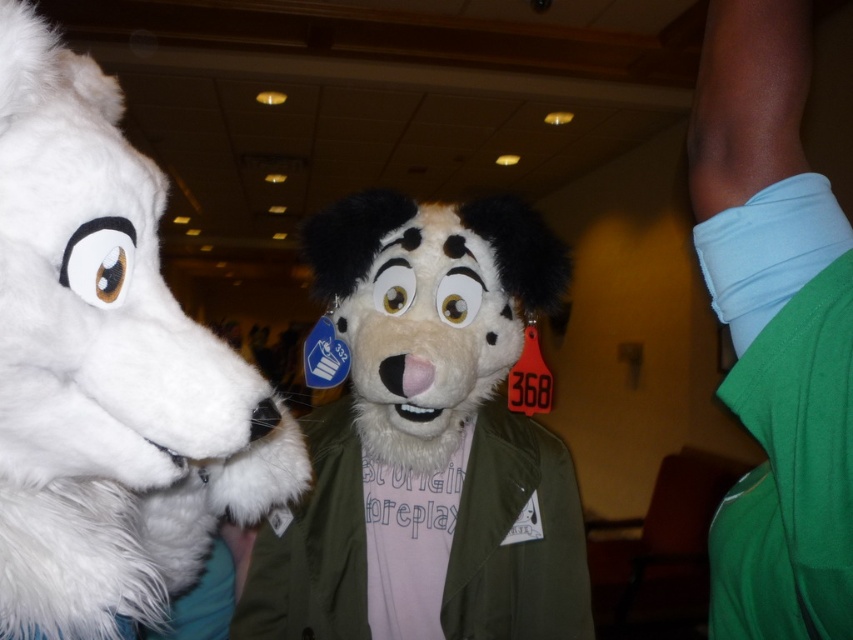
Question: In this image, where is white furry head at left located relative to fuzzy tan dog at center?

Choices:
 (A) below
 (B) above

Answer: (B)

Question: Which point is farther from the camera taking this photo?

Choices:
 (A) (270, 401)
 (B) (735, 125)
 (C) (436, 573)

Answer: (C)

Question: Does fuzzy tan dog at center appear on the right side of green fabric shirt at right?

Choices:
 (A) yes
 (B) no

Answer: (B)

Question: Which point is closer to the camera?

Choices:
 (A) (338, 483)
 (B) (717, 260)

Answer: (B)

Question: Does white furry head at left come behind green fabric shirt at right?

Choices:
 (A) no
 (B) yes

Answer: (A)

Question: Which point appears farthest from the camera in this image?

Choices:
 (A) tap(173, 436)
 (B) tap(782, 524)

Answer: (B)